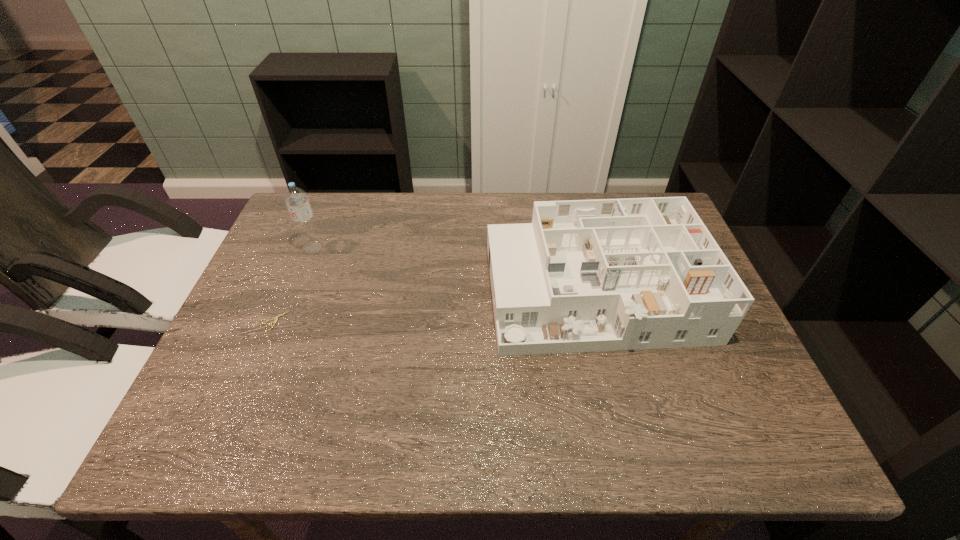
This screenshot has width=960, height=540. Find the location of `vacant area that lies between the tallest object and the shortest object`. vacant area that lies between the tallest object and the shortest object is located at coordinates (294, 284).

Identify the location of free space between the water bottle and the shears. (294, 284).

You are a GUI agent. You are given a task and a screenshot of the screen. Output one action in this format:
    pyautogui.click(x=<x>, y=<y>)
    Task: Click on the vacant region between the dollhouse and the tallest object
    
    Given the screenshot: What is the action you would take?
    pyautogui.click(x=453, y=269)

Identify the location of free space between the shears and the second shortest object. Image resolution: width=960 pixels, height=540 pixels. (435, 306).

In order to click on vacant space that's between the shears and the dollhouse in this screenshot , I will do `click(435, 306)`.

Select which object appears as the second closest to the tallest object. Please provide its 2D coordinates. Your answer should be formatted as a tuple, i.e. [(x, y)], where the tuple contains the x and y coordinates of a point satisfying the conditions above.

[(638, 273)]

Locate which object ranks second in proximity to the shortest object. Please provide its 2D coordinates. Your answer should be formatted as a tuple, i.e. [(x, y)], where the tuple contains the x and y coordinates of a point satisfying the conditions above.

[(638, 273)]

Where is `vacant space that satisfies the following two spatial constraints: 1. on the front side of the second shortest object; 2. on the left side of the tallest object`? Image resolution: width=960 pixels, height=540 pixels. vacant space that satisfies the following two spatial constraints: 1. on the front side of the second shortest object; 2. on the left side of the tallest object is located at coordinates (296, 292).

Identify the location of free space that satisfies the following two spatial constraints: 1. on the back side of the dollhouse; 2. on the left side of the shortest object. (287, 292).

You are a GUI agent. You are given a task and a screenshot of the screen. Output one action in this format:
    pyautogui.click(x=<x>, y=<y>)
    Task: Click on the vacant area in the image that satisfies the following two spatial constraints: 1. on the back side of the water bottle; 2. on the right side of the shortest object
    This screenshot has width=960, height=540.
    Given the screenshot: What is the action you would take?
    pyautogui.click(x=305, y=248)